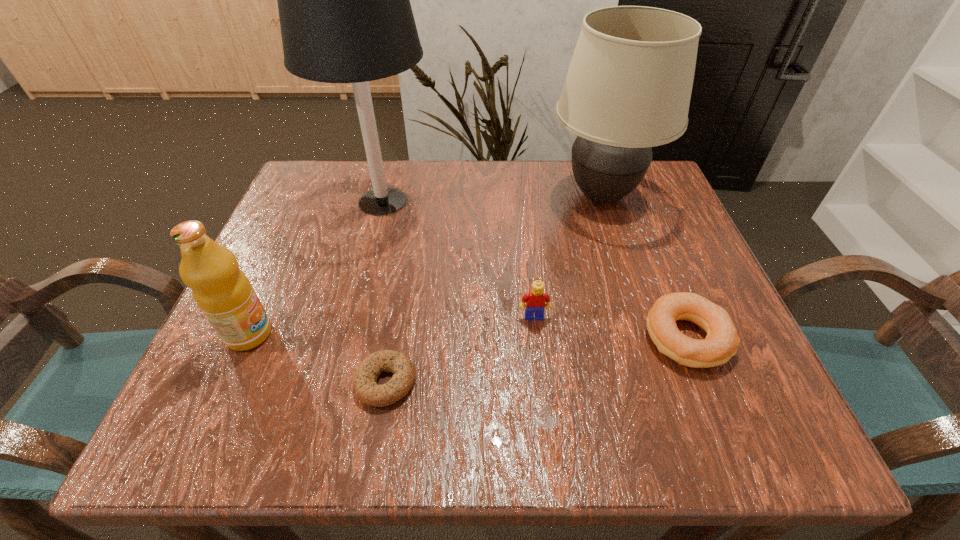
Image resolution: width=960 pixels, height=540 pixels. In order to click on vacant area between the second shortest object and the lampshade in this screenshot , I will do `click(644, 267)`.

I want to click on free spot between the shorter bagel and the fruit juice, so click(x=318, y=357).

Locate an element on the screen. The width and height of the screenshot is (960, 540). object identified as the closest to the third object from right to left is located at coordinates (722, 341).

Locate which object is the second closest to the fifth shortest object. Please provide its 2D coordinates. Your answer should be formatted as a tuple, i.e. [(x, y)], where the tuple contains the x and y coordinates of a point satisfying the conditions above.

[(535, 300)]

Identify the location of vacant point that satisfies the following two spatial constraints: 1. on the front label of the third tallest object; 2. on the right side of the second shortest object. This screenshot has height=540, width=960. (247, 338).

Identify the location of vacant position in the image that satisfies the following two spatial constraints: 1. on the face of the taller bagel; 2. on the left side of the fourth object from left to right. (537, 338).

Identify the location of vacant space that satisfies the following two spatial constraints: 1. on the back side of the second tallest object; 2. on the right side of the left bagel. (417, 196).

I want to click on free space that satisfies the following two spatial constraints: 1. on the front side of the fifth tallest object; 2. on the left side of the table lamp, so click(x=348, y=338).

At what (x,y) coordinates should I click in order to perform the action: click on free spot that satisfies the following two spatial constraints: 1. on the front label of the fruit juice; 2. on the back side of the second shortest object. Please return your answer as a coordinate pair (x, y). Looking at the image, I should click on (247, 338).

Identify the location of free space in the image that satisfies the following two spatial constraints: 1. on the front side of the shortest object; 2. on the right side of the tallest object. (337, 381).